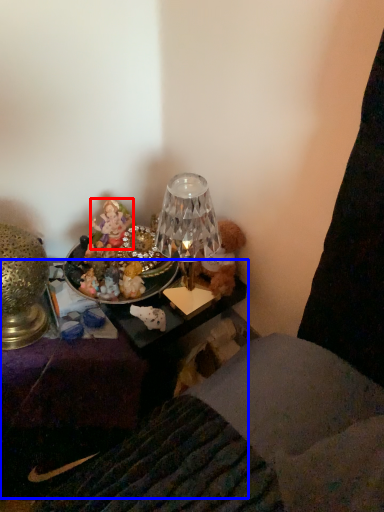
Question: Which point is further to the camera, person (highlighted by a red box) or furniture (highlighted by a blue box)?

Choices:
 (A) person
 (B) furniture

Answer: (A)